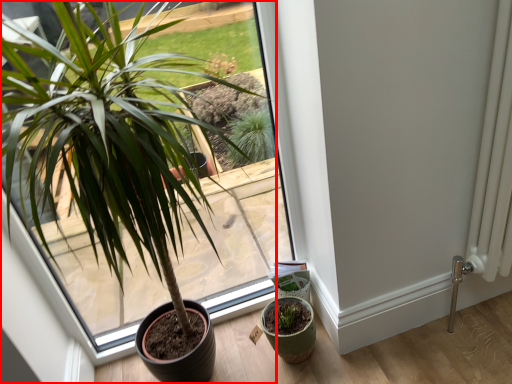
Question: Considering the relative positions of houseplant (annotated by the red box) and flowerpot in the image provided, where is houseplant (annotated by the red box) located with respect to the staircase?

Choices:
 (A) left
 (B) right

Answer: (A)